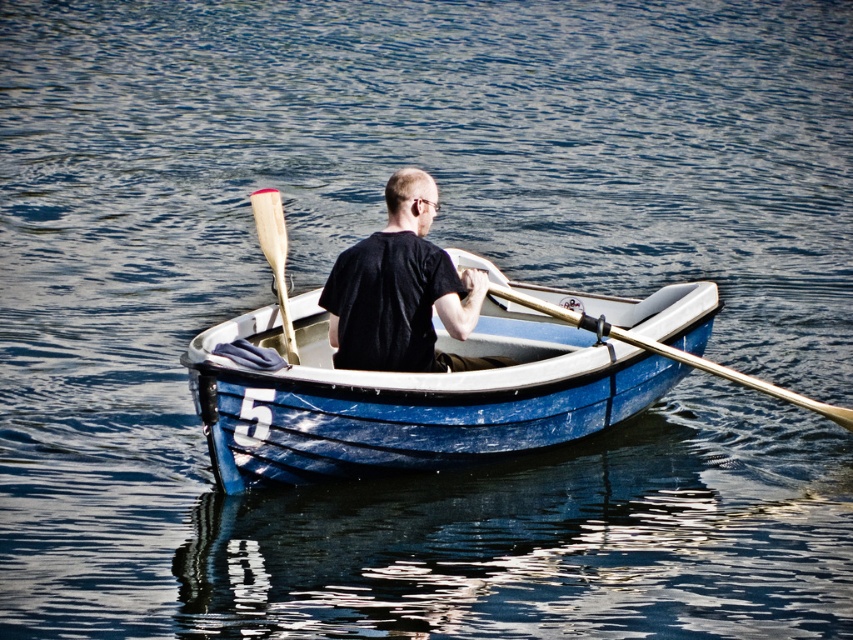
Who is more forward, (363,285) or (277,232)?

Point (277,232)

Between black matte shirt at center and wooden paddle at center, which one has less height?

black matte shirt at center is shorter.

The width and height of the screenshot is (853, 640). Find the location of `black matte shirt at center`. black matte shirt at center is located at coordinates (399, 291).

Based on the photo, is black matte shirt at center wider than wooden polished paddle at center?

Indeed, black matte shirt at center has a greater width compared to wooden polished paddle at center.

Who is positioned more to the right, black matte shirt at center or wooden polished paddle at center?

From the viewer's perspective, wooden polished paddle at center appears more on the right side.

Who is more distant from viewer, (408, 202) or (813, 404)?

Point (813, 404)

This screenshot has height=640, width=853. What are the coordinates of `black matte shirt at center` in the screenshot? It's located at (399, 291).

Is blue polished wood canoe at center in front of black matte shirt at center?

Yes, blue polished wood canoe at center is in front of black matte shirt at center.

This screenshot has width=853, height=640. What do you see at coordinates (408, 396) in the screenshot?
I see `blue polished wood canoe at center` at bounding box center [408, 396].

Is point (587, 369) behind point (445, 291)?

Yes.

The width and height of the screenshot is (853, 640). I want to click on blue polished wood canoe at center, so click(x=408, y=396).